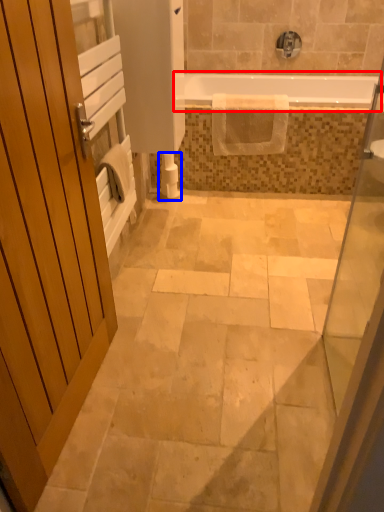
Question: Which of the following is the closest to the observer, bathtub (highlighted by a red box) or toilet paper (highlighted by a blue box)?

Choices:
 (A) bathtub
 (B) toilet paper

Answer: (A)